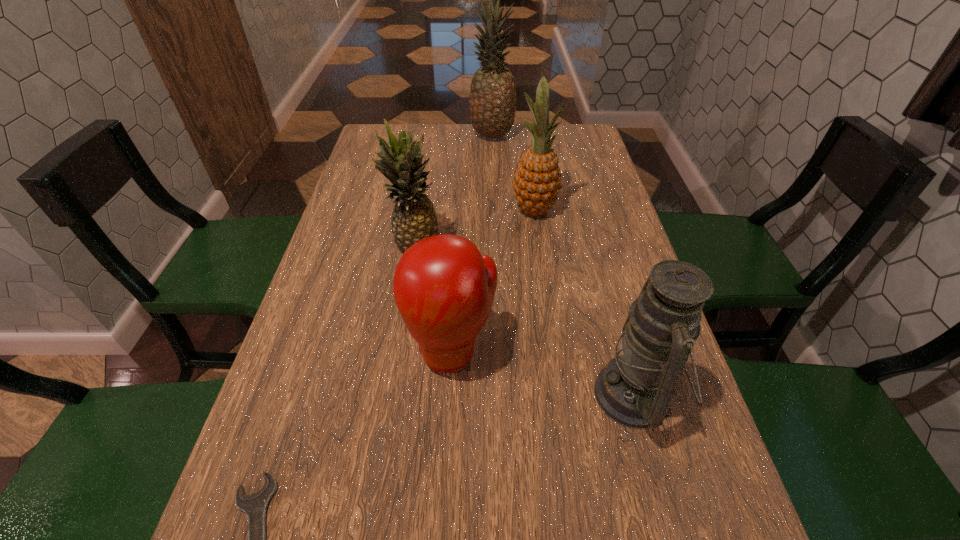
This screenshot has width=960, height=540. Find the location of `vacant space located on the left of the oil lamp`. vacant space located on the left of the oil lamp is located at coordinates (535, 395).

You are a GUI agent. You are given a task and a screenshot of the screen. Output one action in this format:
    pyautogui.click(x=<x>, y=<y>)
    Task: Click on the free space located 0.140m on the striking surface of the boxing glove
    
    Given the screenshot: What is the action you would take?
    pyautogui.click(x=446, y=463)

The width and height of the screenshot is (960, 540). I want to click on object that is positioned at the far edge, so click(492, 104).

You are a GUI agent. You are given a task and a screenshot of the screen. Output one action in this format:
    pyautogui.click(x=<x>, y=<y>)
    Task: Click on the object positioned at the left edge
    The width and height of the screenshot is (960, 540).
    Given the screenshot: What is the action you would take?
    click(413, 218)

Identify the location of object positioned at the right edge. The image size is (960, 540). (635, 389).

The image size is (960, 540). I want to click on vacant space at the left edge of the desktop, so click(x=390, y=205).

The height and width of the screenshot is (540, 960). I want to click on free space at the right edge of the desktop, so [589, 195].

Identify the location of empty space between the oil lamp and the farthest object. Image resolution: width=960 pixels, height=540 pixels. (564, 265).

You are a GUI agent. You are given a task and a screenshot of the screen. Output one action in this format:
    pyautogui.click(x=<x>, y=<y>)
    Task: Click on the empty space between the fifth nearest object and the tallest pineapple
    This screenshot has height=540, width=960.
    Given the screenshot: What is the action you would take?
    pyautogui.click(x=513, y=172)

Where is `vacant area between the farthest object and the second farthest pineapple`? Image resolution: width=960 pixels, height=540 pixels. vacant area between the farthest object and the second farthest pineapple is located at coordinates (513, 172).